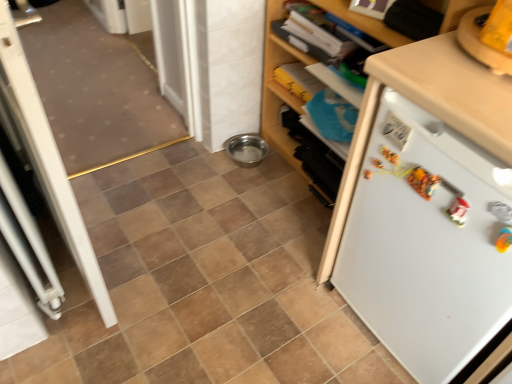
Find the location of a particular element. This screenshot has height=384, width=512. vacant area to the right of white plastic screen door at left is located at coordinates (187, 262).